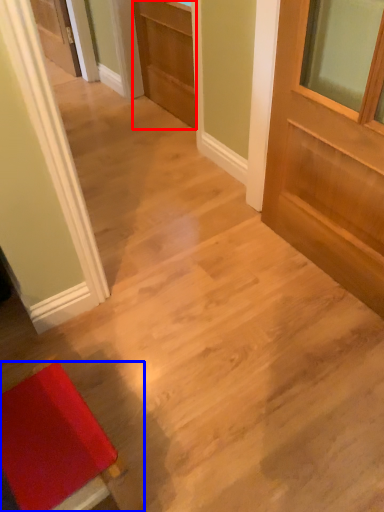
Question: Which object appears farthest to the camera in this image, door (highlighted by a red box) or furniture (highlighted by a blue box)?

Choices:
 (A) door
 (B) furniture

Answer: (A)